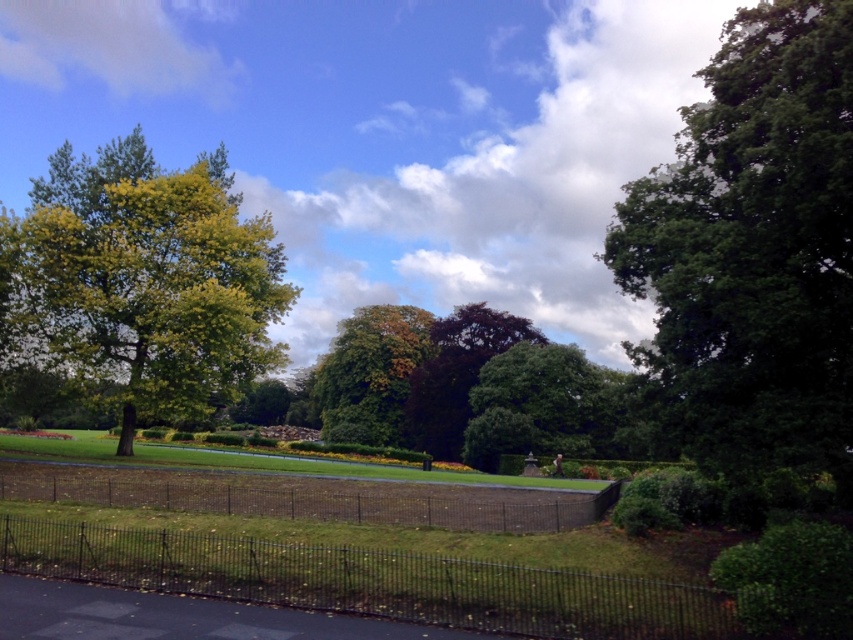
Question: Among these objects, which one is farthest from the camera?

Choices:
 (A) black metal fence at center
 (B) green leafy tree at upper right
 (C) dark green leafy tree at center
 (D) black metal fence at lower center

Answer: (C)

Question: Which point is farther to the camera?

Choices:
 (A) black metal fence at lower center
 (B) dark green leafy tree at center
 (C) green leafy tree at center

Answer: (C)

Question: Is yellow-green foliage at upper left further to the viewer compared to green leafy tree at center?

Choices:
 (A) yes
 (B) no

Answer: (B)

Question: Is black metal fence at lower center thinner than green leafy tree at center?

Choices:
 (A) yes
 (B) no

Answer: (A)

Question: Considering the real-world distances, which object is closest to the black metal fence at lower center?

Choices:
 (A) black metal fence at center
 (B) dark green leafy tree at center

Answer: (A)

Question: Does green leafy tree at upper right appear over dark green leafy tree at center?

Choices:
 (A) no
 (B) yes

Answer: (B)